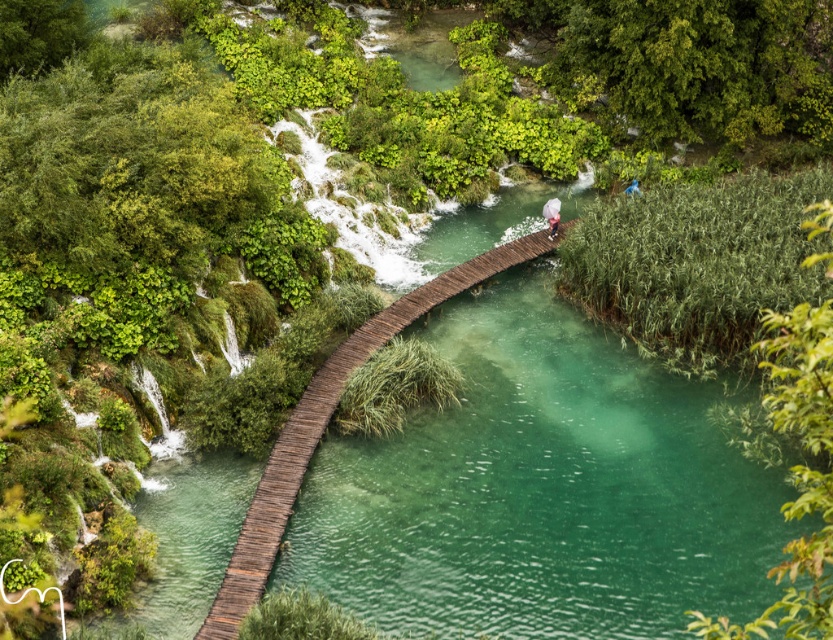
Which of these two, light pink fabric umbrella at center or blue fabric person at upper center, stands shorter?

blue fabric person at upper center

Does point (555, 230) come in front of point (636, 180)?

Yes, point (555, 230) is closer to viewer.

Is point (552, 237) behind point (629, 184)?

No, (552, 237) is in front of (629, 184).

The height and width of the screenshot is (640, 833). I want to click on light pink fabric umbrella at center, so click(x=552, y=216).

Is wooden bridge at center positioned behind blue fabric person at upper center?

No, wooden bridge at center is in front of blue fabric person at upper center.

From the picture: Is wooden bridge at center wider than blue fabric person at upper center?

Yes, wooden bridge at center is wider than blue fabric person at upper center.

The height and width of the screenshot is (640, 833). I want to click on wooden bridge at center, so click(325, 426).

Locate an element on the screen. wooden bridge at center is located at coordinates (325, 426).

Who is taller, wooden bridge at center or light pink fabric umbrella at center?

wooden bridge at center

Who is more distant from viewer, [267,470] or [557,209]?

The point [557,209] is more distant.

This screenshot has height=640, width=833. In order to click on wooden bridge at center in this screenshot , I will do `click(325, 426)`.